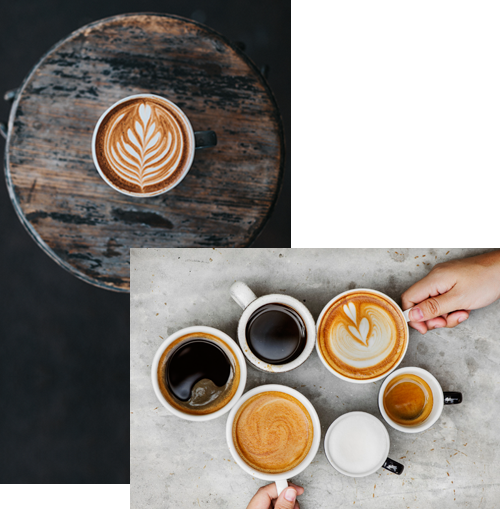
The width and height of the screenshot is (500, 509). What are the coordinates of `mug` in the screenshot? It's located at (441, 394), (393, 466), (283, 485), (212, 329), (255, 302), (353, 292), (194, 146).